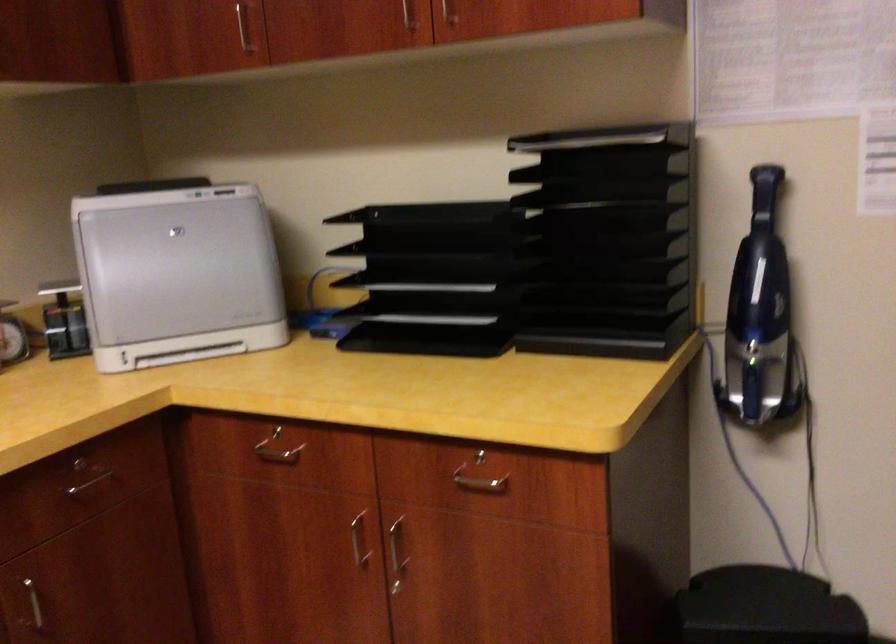
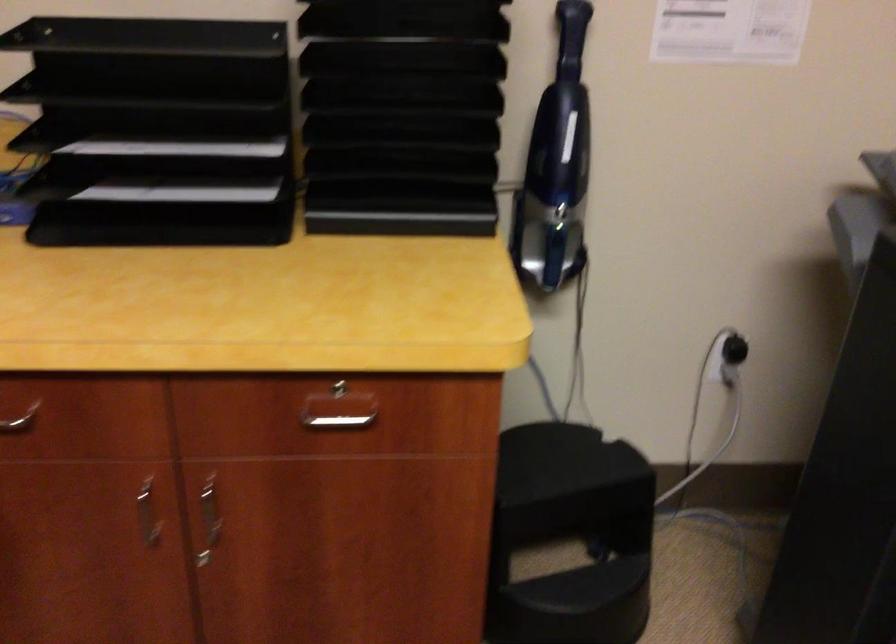
Where in the second image is the point corresponding to [401,558] from the first image?

(209, 520)